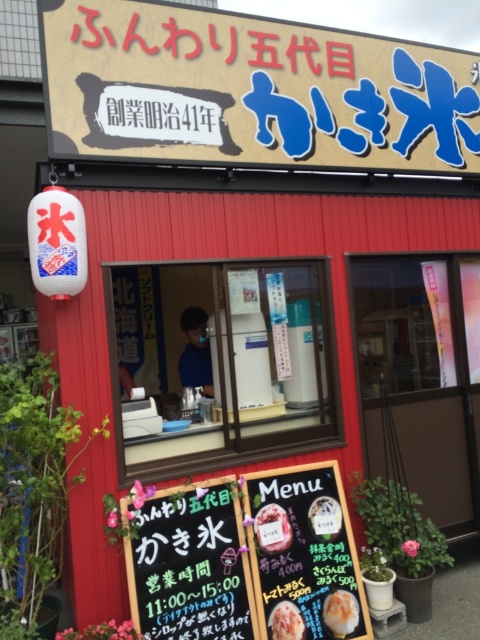
You are standing in front of the Japanese ice cream shop and need to locate the matte cardboard signboard at upper center. According to the scene description, where exactly is this signboard positioned relative to the main shop signage?

The matte cardboard signboard at upper center is located at point [251,90], which is slightly to the left and below the main shop signage.

You are a customer standing in front of the ice cream shop. You see the white paper menu at lower center and the white glossy ice cream at center. Which object is wider?

The white paper menu at lower center is wider than the white glossy ice cream at center.

You are a customer at the ice cream shop and you want to read the white paper menu at lower center while holding the matte orange ice cream at lower center. Can you hold both at the same time without dropping either?

The white paper menu at lower center has a larger size compared to matte orange ice cream at lower center, so it might be challenging to hold both at the same time without dropping either due to their combined size.